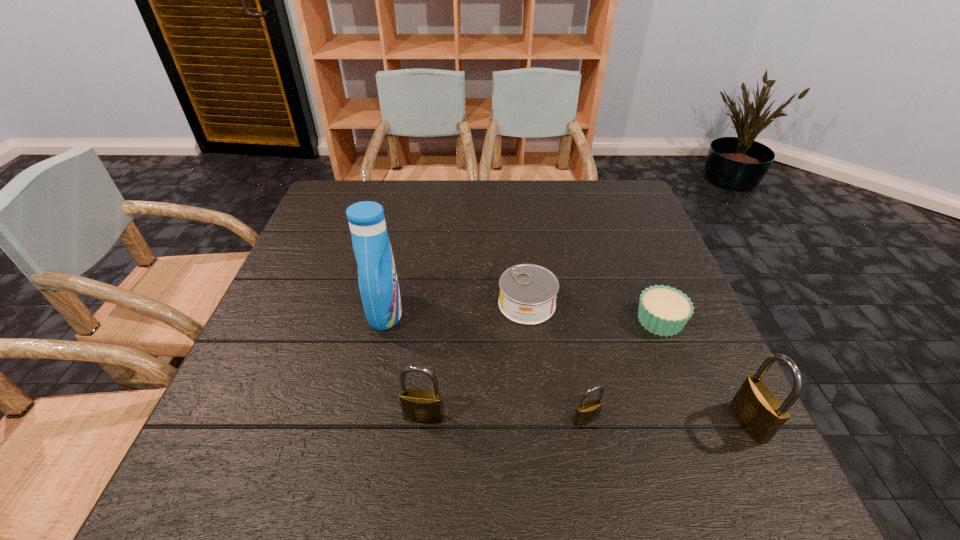
Locate an element on the screen. This screenshot has width=960, height=540. free space for a new padlock on the left is located at coordinates (264, 414).